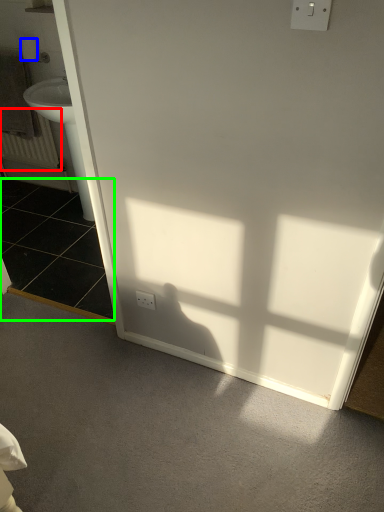
Question: Considering the real-world distances, which object is farthest from radiator (highlighted by a red box)? toilet paper (highlighted by a blue box) or tile (highlighted by a green box)?

Choices:
 (A) toilet paper
 (B) tile

Answer: (A)